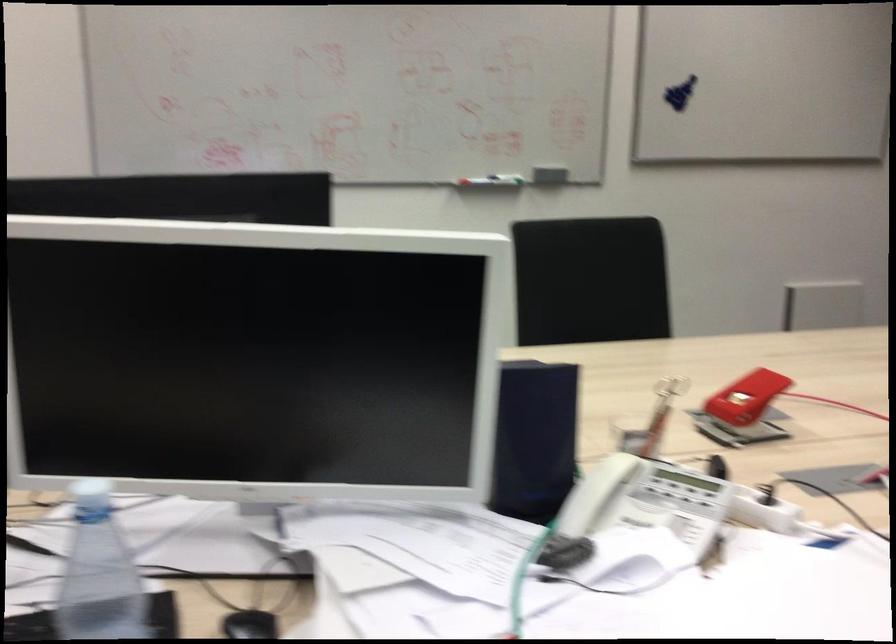
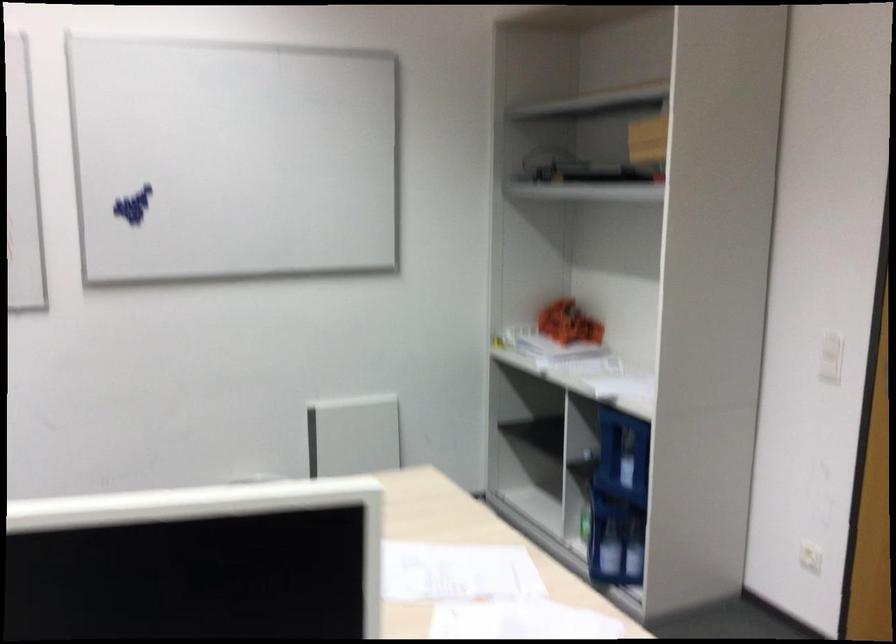
Question: What movement of the cameraman would produce the second image?

Choices:
 (A) Left
 (B) Right
 (C) Forward
 (D) Backward

Answer: (B)